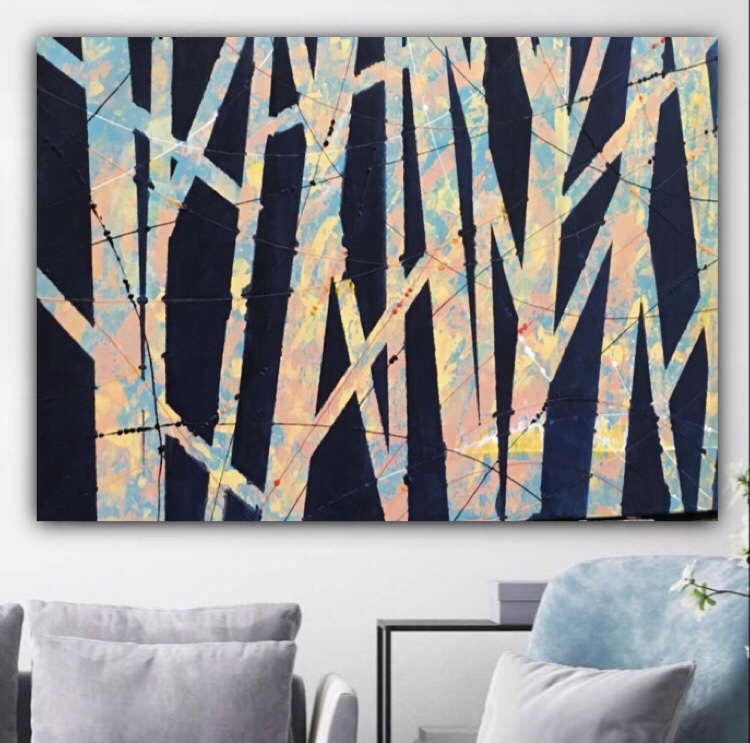
You are a GUI agent. You are given a task and a screenshot of the screen. Output one action in this format:
    pyautogui.click(x=<x>, y=<y>)
    Task: Click on the plant
    Image resolution: width=750 pixels, height=743 pixels.
    Given the screenshot: What is the action you would take?
    pyautogui.click(x=742, y=486)